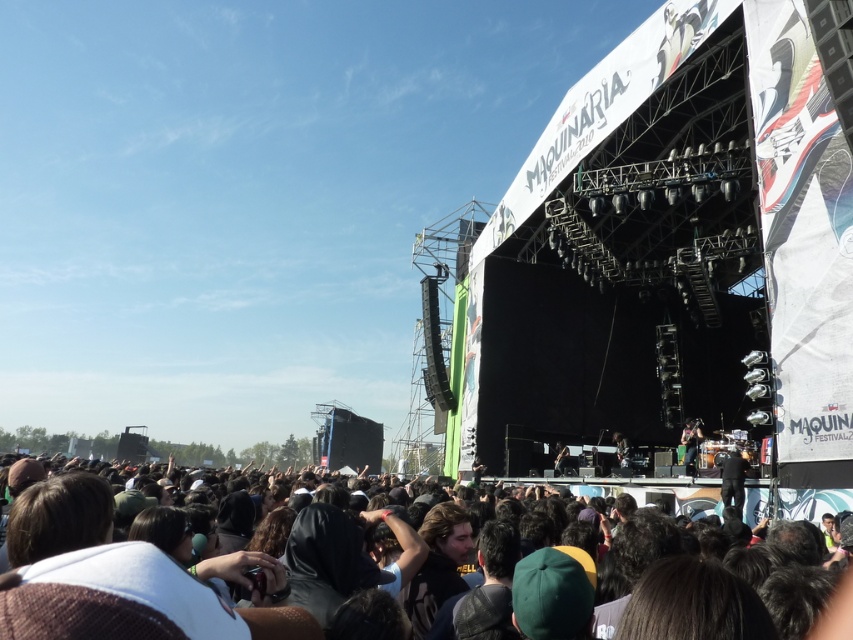
Question: Observing the image, what is the correct spatial positioning of dark brown hair at lower center in reference to shiny black guitar at center?

Choices:
 (A) left
 (B) right

Answer: (A)

Question: Is dark brown hair at lower center positioned in front of shiny black guitar at center?

Choices:
 (A) yes
 (B) no

Answer: (A)

Question: Is dark brown hair at lower center smaller than shiny black guitar at center?

Choices:
 (A) yes
 (B) no

Answer: (B)

Question: Which point is closer to the camera taking this photo?

Choices:
 (A) (137, 609)
 (B) (686, 436)

Answer: (A)

Question: Which object appears farthest from the camera in this image?

Choices:
 (A) shiny black guitar at center
 (B) dark brown hair at lower center

Answer: (A)